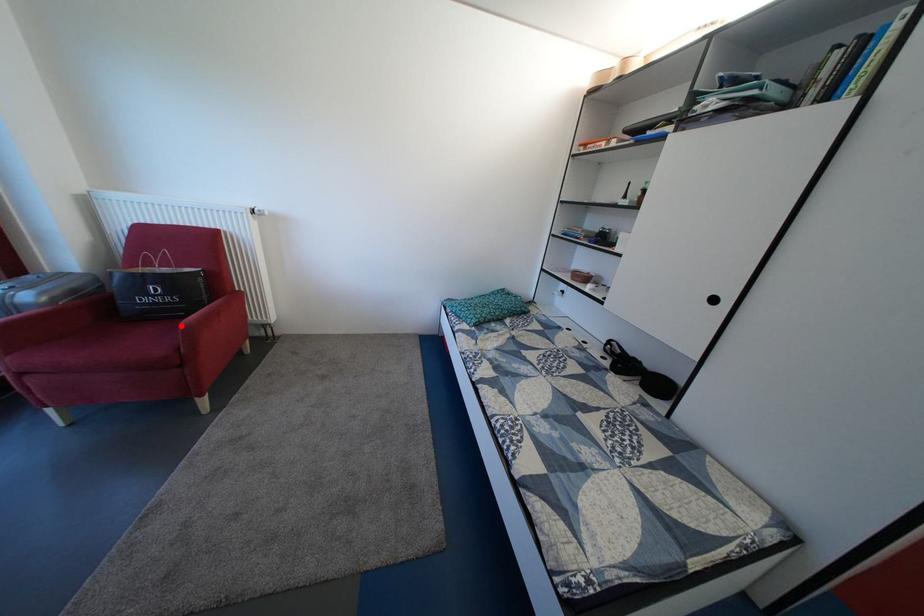
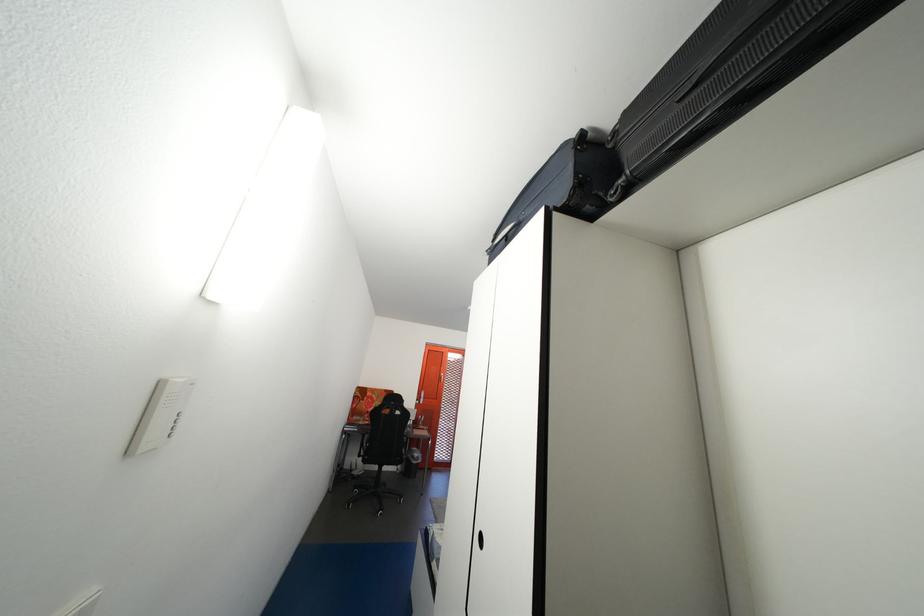
Question: I am providing you with two images of the same scene from different viewpoints. A red point is marked on the first image. At the location where the point appears in image 1, is it still visible in image 2?

Choices:
 (A) Yes
 (B) No

Answer: (B)